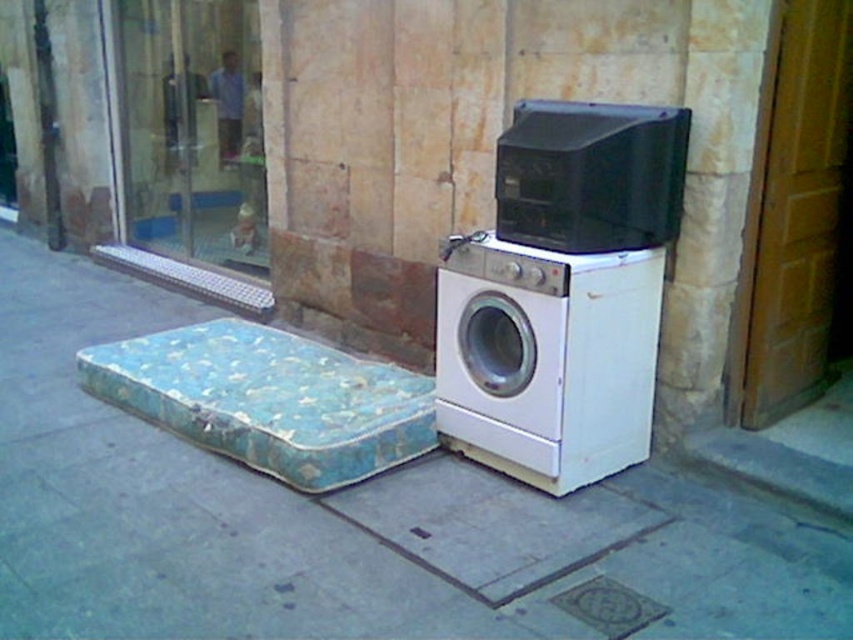
You are moving a box from the blue fabric mattress at lower left to the white matte washing machine at lower right. Which object will the box pass over first?

The box will pass over the blue fabric mattress at lower left first because it is closer to the starting point than the white matte washing machine at lower right.

You are a delivery person trying to deliver a package to the blue fabric mattress at lower left. There is a black plastic microwave at upper center blocking the path. Can you move the microwave to access the mattress?

The black plastic microwave at upper center is behind the blue fabric mattress at lower left, so moving it would not block the path to the mattress. The microwave is actually behind the mattress, so it does not obstruct the delivery path.

Based on the photo, you are a delivery person trying to park your van on the sidewalk. The van requires a space larger than the gray concrete curb at lower right. Can the space next to the white matte washing machine at lower right accommodate your van?

The white matte washing machine at lower right is bigger than the gray concrete curb at lower right. Since the van requires a space larger than the gray concrete curb at lower right, the space next to the white matte washing machine at lower right may be too small to accommodate the van.